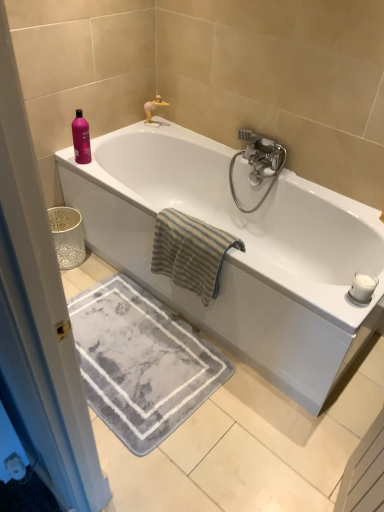
Question: Relative to beige striped towel at center, is silver metallic faucet at upper center in front or behind?

Choices:
 (A) front
 (B) behind

Answer: (B)

Question: Is silver metallic faucet at upper center bigger or smaller than beige striped towel at center?

Choices:
 (A) big
 (B) small

Answer: (B)

Question: Estimate the real-world distances between objects in this image. Which object is farther from the silver metallic faucet at upper center?

Choices:
 (A) pink glossy bottle at upper left
 (B) gray soft rug at lower center
 (C) satin nickel faucet at upper right
 (D) beige striped towel at center
 (E) white glossy bathtub at upper center

Answer: (B)

Question: Which object is the closest to the satin nickel faucet at upper right?

Choices:
 (A) gray soft rug at lower center
 (B) white glossy bathtub at upper center
 (C) silver metallic faucet at upper center
 (D) beige striped towel at center
 (E) pink glossy bottle at upper left

Answer: (B)